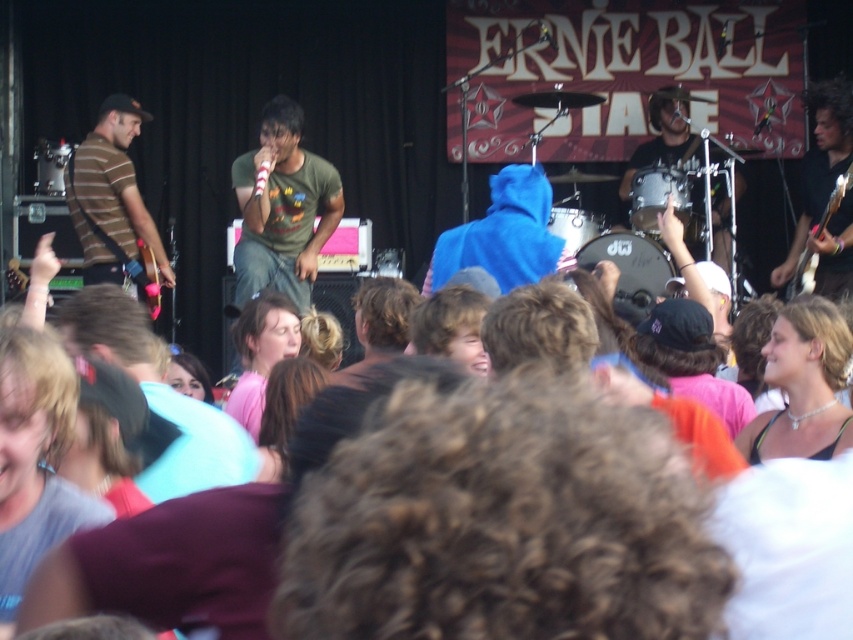
You are a photographer at the concert and want to capture a closeup of the drummer on the right side of the stage. You notice a point at coordinates point [114,204]. Is this point located on the striped jersey guitar at left or somewhere else?

The point [114,204] is on the striped jersey guitar at left, so it is not located on the drummer on the right side of the stage.

In the scene shown: You are a photographer at the ERNIE BALL STAGE concert. You need to capture a shot of the drummer on the right side of the stage and the pink fabric at center. Where should you position yourself to include both in the frame?

To include both the drummer on the right side of the stage and the pink fabric at center in the frame, position yourself at the center of the stage area. The pink fabric at center is located at point coordinates approximately 0.552 on the x and 0.307 on the y axis, so aligning your camera towards this central point will ensure both elements are captured.